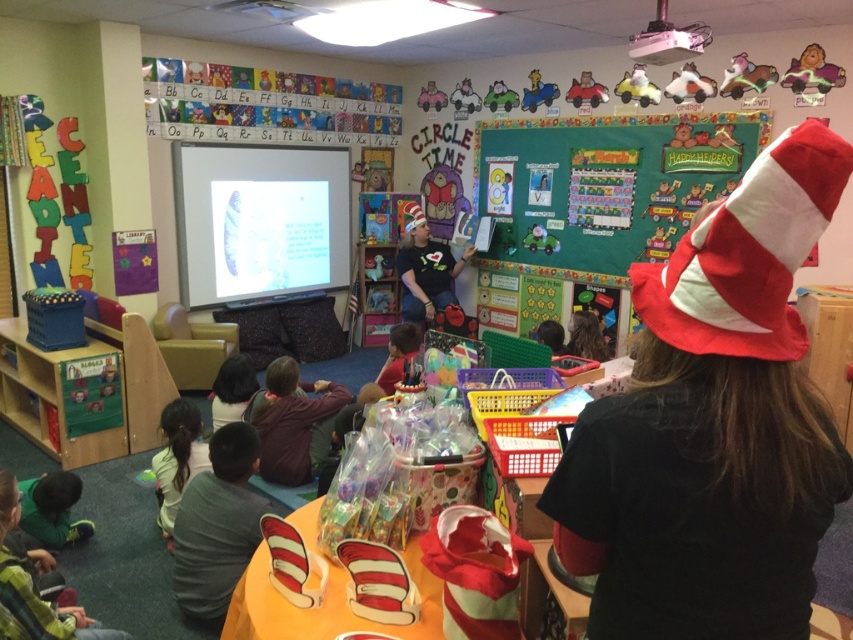
You are a teacher in the classroom. You need to hang a new poster on the wall. The bulletin board is at point (606, 182). Where is the bulletin board located?

The bulletin board is located at point (606, 182), which is the green matte bulletin board at upper center.

You are a teacher in the classroom and need to hand out a sticker to the child wearing the dark brown sweater at lower left and the child with the dark brown hair at lower left. Which child should you give the sticker to first if you want to give it to the one closer to the table with the orange tablecloth?

The dark brown sweater at lower left is larger in size than the dark brown hair at lower left, but size does not determine proximity. Without additional information about their positions relative to the table, I cannot determine which child is closer.